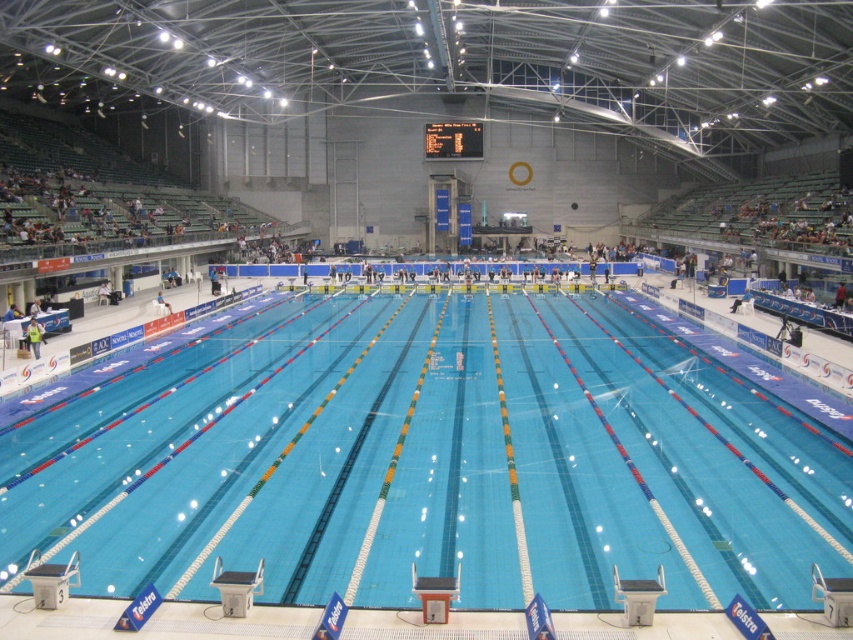
Can you confirm if clear blue water at center is positioned to the left of light blue fabric shirt at lower left?

Incorrect, clear blue water at center is not on the left side of light blue fabric shirt at lower left.

Is clear blue water at center smaller than light blue fabric shirt at lower left?

Actually, clear blue water at center might be larger than light blue fabric shirt at lower left.

Is point (231, 404) farther from camera compared to point (28, 344)?

No.

Where is `clear blue water at center`? The height and width of the screenshot is (640, 853). clear blue water at center is located at coordinates (430, 461).